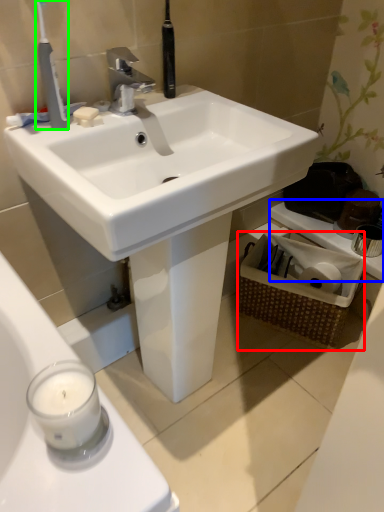
Question: Which object is the farthest from basket (highlighted by a red box)? Choose among these: counter top (highlighted by a blue box) or toothbrush (highlighted by a green box).

Choices:
 (A) counter top
 (B) toothbrush

Answer: (B)